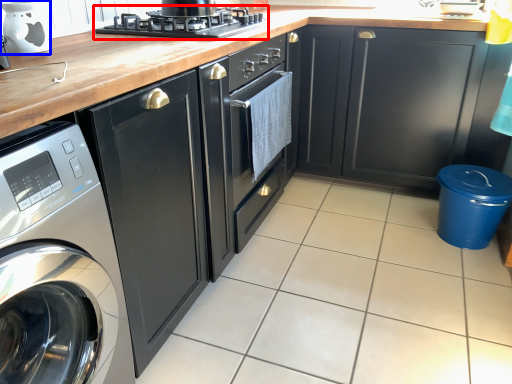
Question: Which point is closer to the camera, kitchen appliance (highlighted by a red box) or appliance (highlighted by a blue box)?

Choices:
 (A) kitchen appliance
 (B) appliance

Answer: (B)